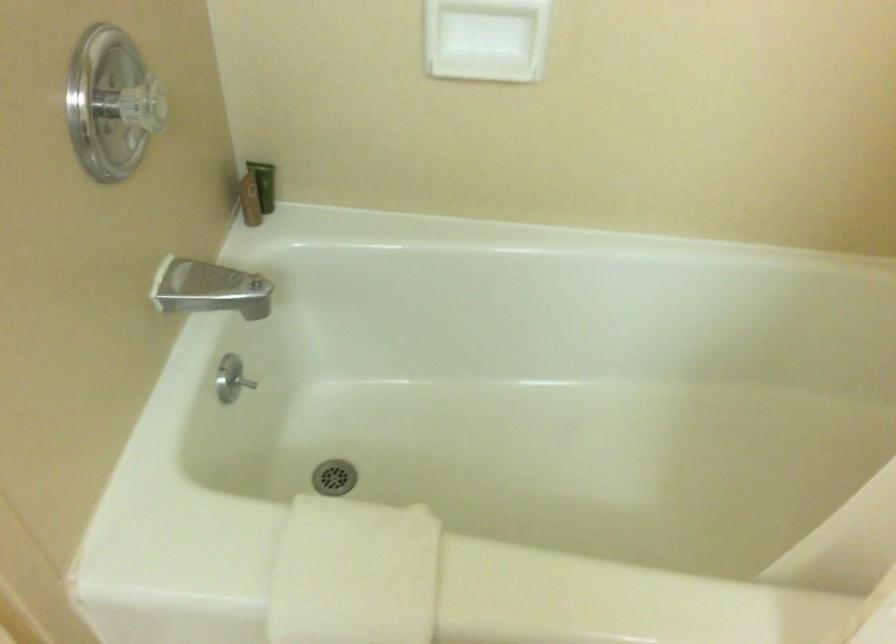
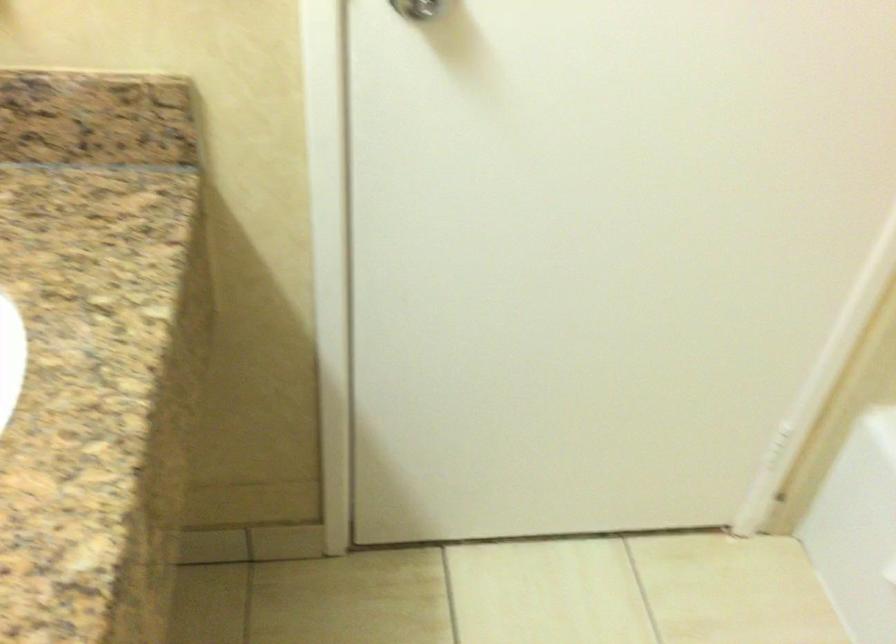
From the picture: Based on the continuous images, in which direction is the camera rotating?

The camera's rotation is toward left-down.